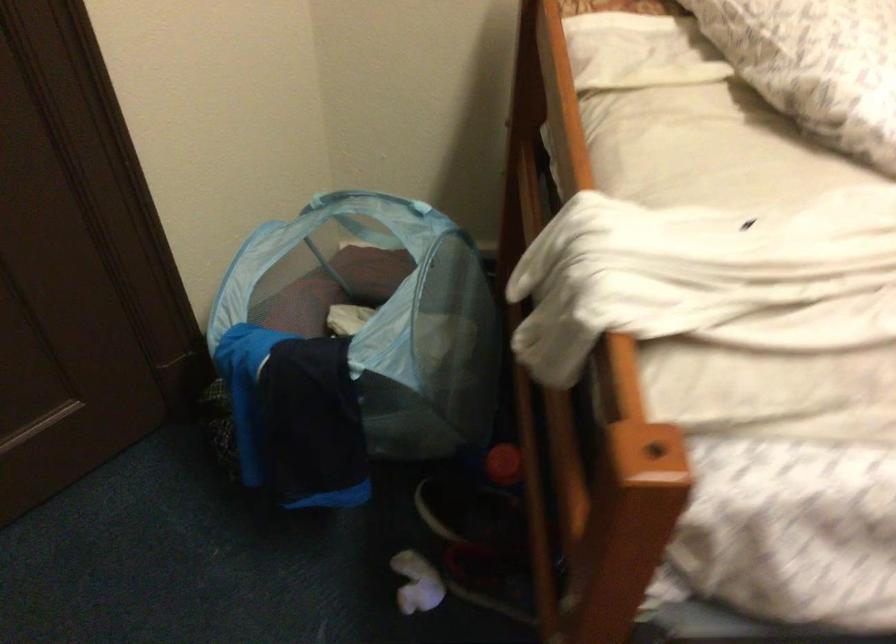
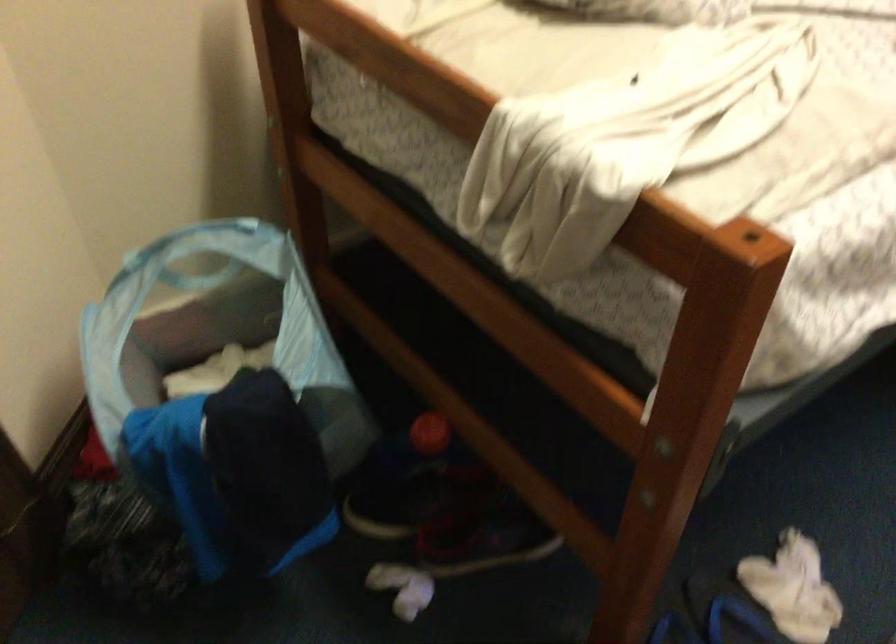
Question: Based on the continuous images, in which direction is the camera rotating? Reply with the corresponding letter.

Choices:
 (A) Left
 (B) Right
 (C) Up
 (D) Down

Answer: (B)